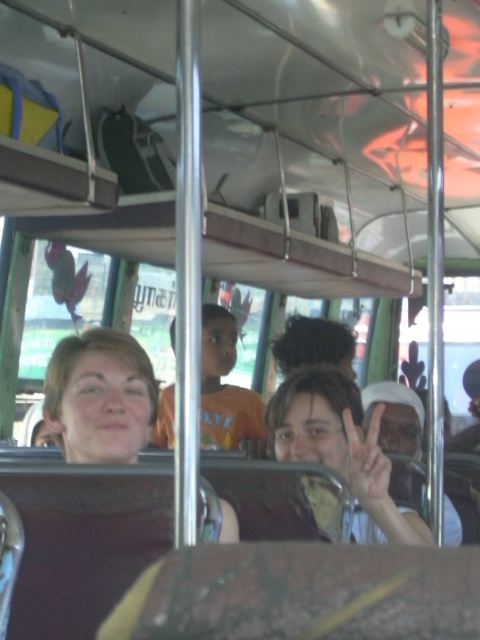
Question: Which point is closer to the camera taking this photo?

Choices:
 (A) (385, 502)
 (B) (231, 417)

Answer: (A)

Question: Is orange t-shirt at center above matte skin hand at center?

Choices:
 (A) no
 (B) yes

Answer: (A)

Question: Which point is closer to the camera?

Choices:
 (A) (224, 388)
 (B) (364, 488)

Answer: (B)

Question: Which point is closer to the camera taking this photo?

Choices:
 (A) (240, 436)
 (B) (362, 477)

Answer: (B)

Question: Is orange t-shirt at center above matte skin hand at center?

Choices:
 (A) yes
 (B) no

Answer: (B)

Question: Is orange t-shirt at center closer to camera compared to matte skin hand at center?

Choices:
 (A) no
 (B) yes

Answer: (A)